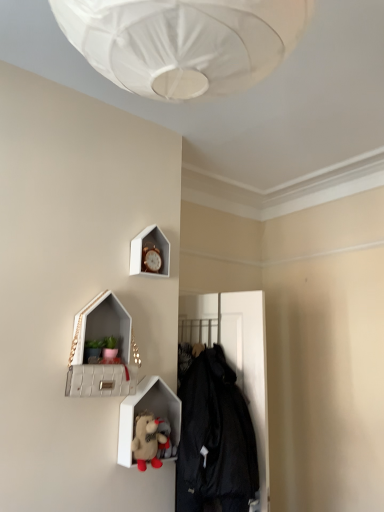
Question: Does point (152, 439) appear closer or farther from the camera than point (112, 303)?

Choices:
 (A) closer
 (B) farther

Answer: (A)

Question: In terms of height, does fluffy plush toy at lower center look taller or shorter compared to white quilted leather medicine cabinet at upper left?

Choices:
 (A) tall
 (B) short

Answer: (B)

Question: Which object is the farthest from the fluffy plush toy at lower center?

Choices:
 (A) white textured shelf at lower center
 (B) gold metallic clock at upper center
 (C) white quilted leather medicine cabinet at upper left
 (D) black matte coat at center

Answer: (B)

Question: Which object is positioned farthest from the gold metallic clock at upper center?

Choices:
 (A) black matte coat at center
 (B) white quilted leather medicine cabinet at upper left
 (C) fluffy plush toy at lower center
 (D) white textured shelf at lower center

Answer: (C)